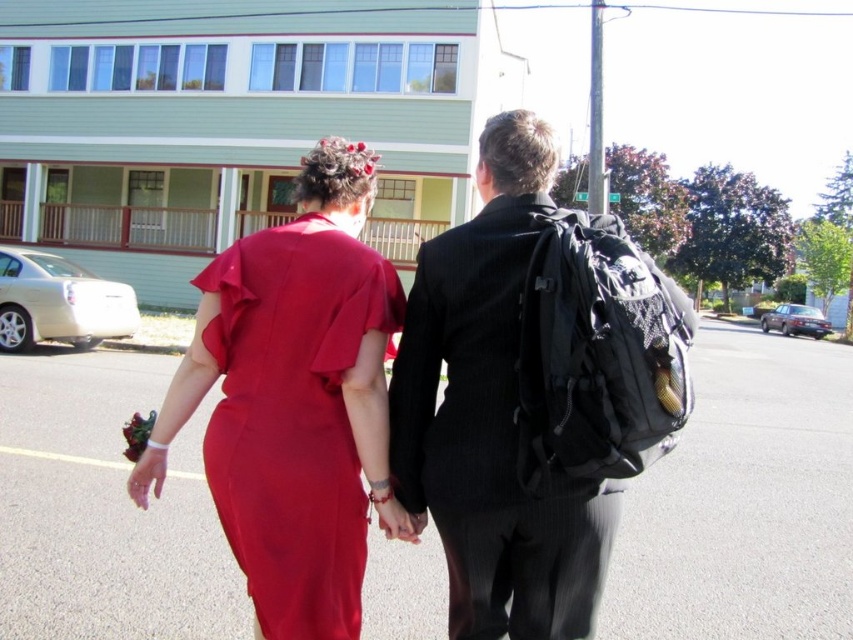
Question: Is black pinstripe suit at center closer to the viewer compared to matte red dress at center?

Choices:
 (A) yes
 (B) no

Answer: (A)

Question: Can you confirm if black pinstripe suit at center is positioned to the left of matte red dress at center?

Choices:
 (A) yes
 (B) no

Answer: (B)

Question: Can you confirm if black pinstripe suit at center is wider than matte red dress at center?

Choices:
 (A) no
 (B) yes

Answer: (B)

Question: Which object is farther from the camera taking this photo?

Choices:
 (A) matte red dress at center
 (B) black pinstripe suit at center

Answer: (A)

Question: Which object is farther from the camera taking this photo?

Choices:
 (A) matte red dress at center
 (B) black pinstripe suit at center

Answer: (A)